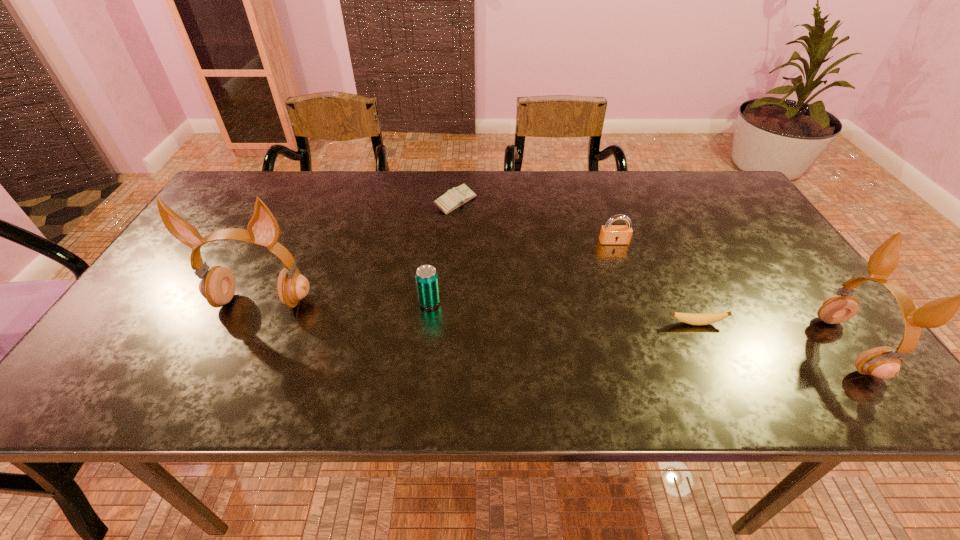
Find the location of a particular element. This screenshot has width=960, height=540. vacant space at the near edge is located at coordinates (767, 361).

Identify the location of free location at the left edge. (158, 307).

Identify the location of free space at the right edge of the desktop. The width and height of the screenshot is (960, 540). (800, 298).

The width and height of the screenshot is (960, 540). Identify the location of vacant space at the far left corner of the desktop. (223, 206).

Find the location of `free location at the far right corner`. free location at the far right corner is located at coordinates tap(684, 183).

Where is `free space between the beer can and the fifth nearest object`? free space between the beer can and the fifth nearest object is located at coordinates (521, 272).

Where is `unoccupied position between the fourth object from left to right and the left earphone`? The width and height of the screenshot is (960, 540). unoccupied position between the fourth object from left to right and the left earphone is located at coordinates (438, 272).

Identify the location of vacant area that lies between the fifth object from left to right and the right earphone. This screenshot has height=540, width=960. (772, 335).

I want to click on vacant space that is in between the taller earphone and the beer can, so click(346, 301).

Find the location of `unoccupied position between the leftmost object and the banana`. unoccupied position between the leftmost object and the banana is located at coordinates (479, 312).